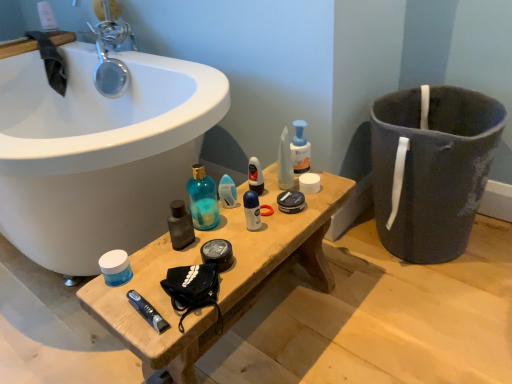
At what (x,y) coordinates should I click in order to perform the action: click on vacant location behind white matte deodorant at center, arranged as the 2th toiletry when viewed from the left. Please return your answer as a coordinate pair (x, y). Image resolution: width=512 pixels, height=384 pixels. Looking at the image, I should click on (263, 193).